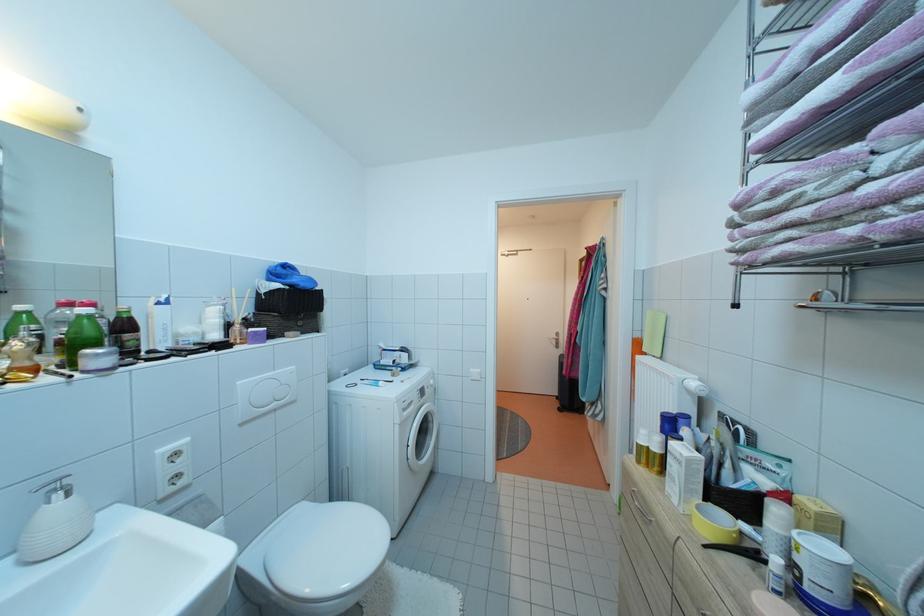
This screenshot has width=924, height=616. Describe the element at coordinates (426, 390) in the screenshot. I see `the washing machine dial` at that location.